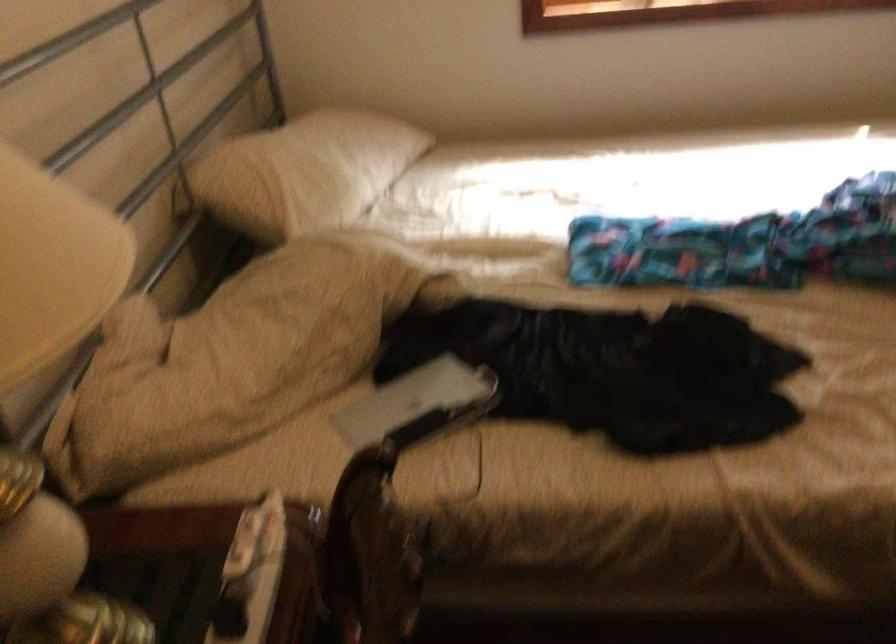
Where would you lift the silver electronic device? Please return your answer as a coordinate pair (x, y).

(418, 404)